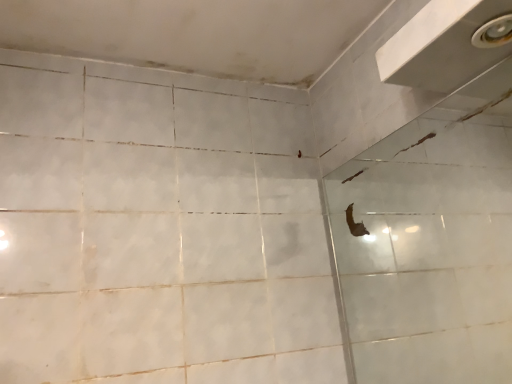
The height and width of the screenshot is (384, 512). Identify the location of metallic circular light fixture at upper right. (493, 32).

Describe the element at coordinates (493, 32) in the screenshot. I see `metallic circular light fixture at upper right` at that location.

Locate an element on the screen. metallic circular light fixture at upper right is located at coordinates (493, 32).